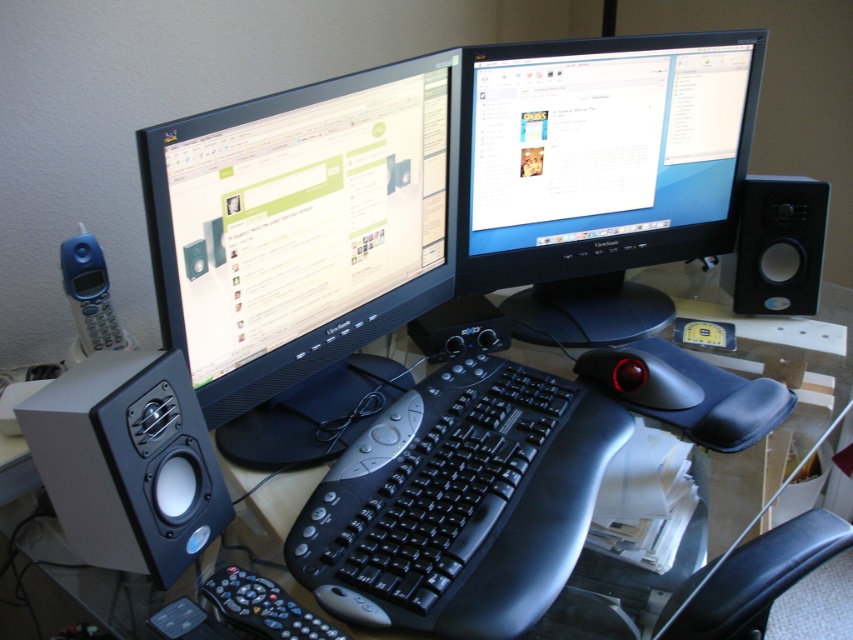
Question: Can you confirm if blue plastic phone at left is wider than black plastic mouse at center?

Choices:
 (A) no
 (B) yes

Answer: (A)

Question: In this image, where is matte black speaker at left located relative to black matte speaker at right?

Choices:
 (A) right
 (B) left

Answer: (B)

Question: Which object appears farthest from the camera in this image?

Choices:
 (A) matte black monitor at center
 (B) black plastic keyboard at center

Answer: (A)

Question: Among these objects, which one is farthest from the camera?

Choices:
 (A) matte black monitor at center
 (B) black plastic mouse at center

Answer: (B)

Question: Based on their relative distances, which object is farther from the black plastic keyboard at center?

Choices:
 (A) black matte speaker at right
 (B) matte black monitor at center

Answer: (A)

Question: Is black glossy monitor at center positioned in front of black matte speaker at right?

Choices:
 (A) no
 (B) yes

Answer: (B)